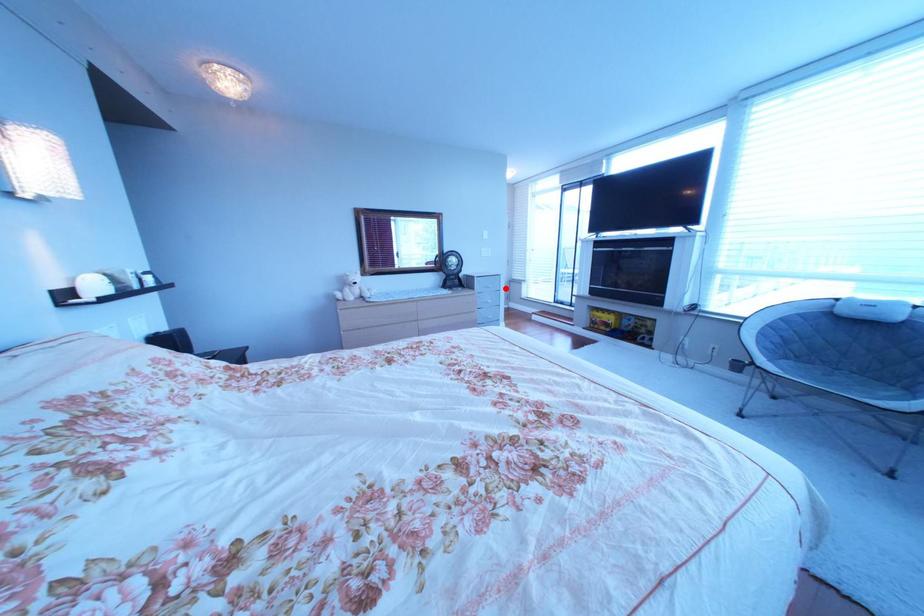
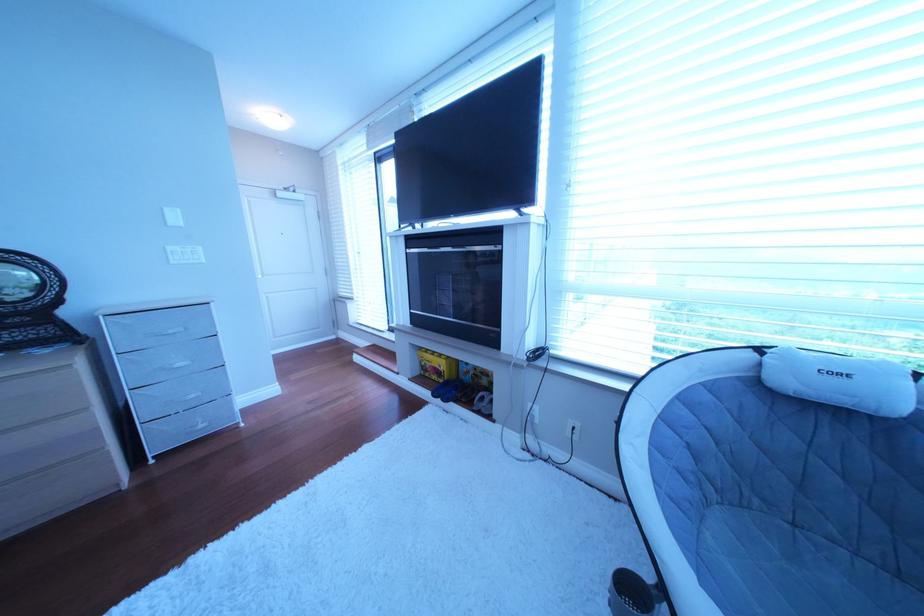
Where in the second image is the point corresponding to the highlighted location from the first image?

(188, 334)